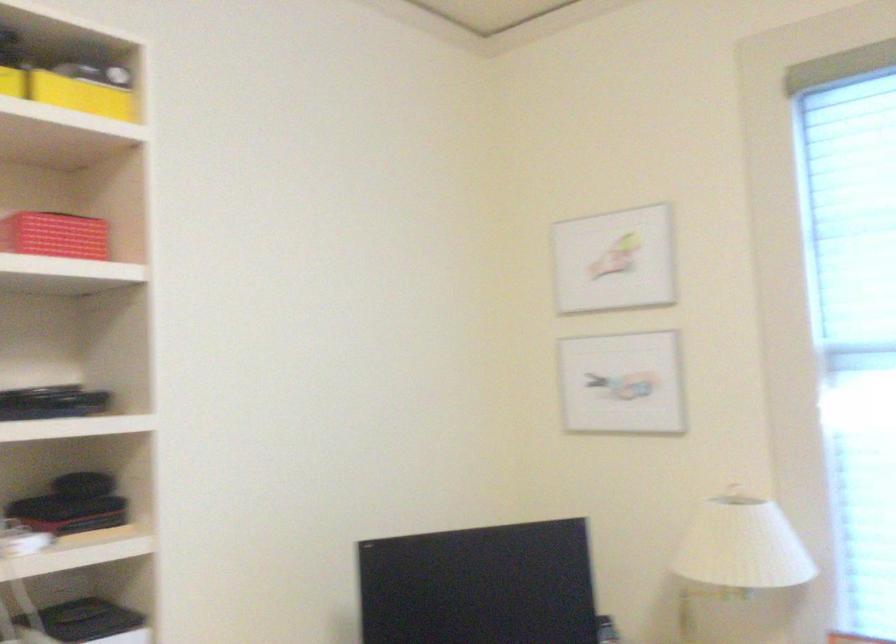
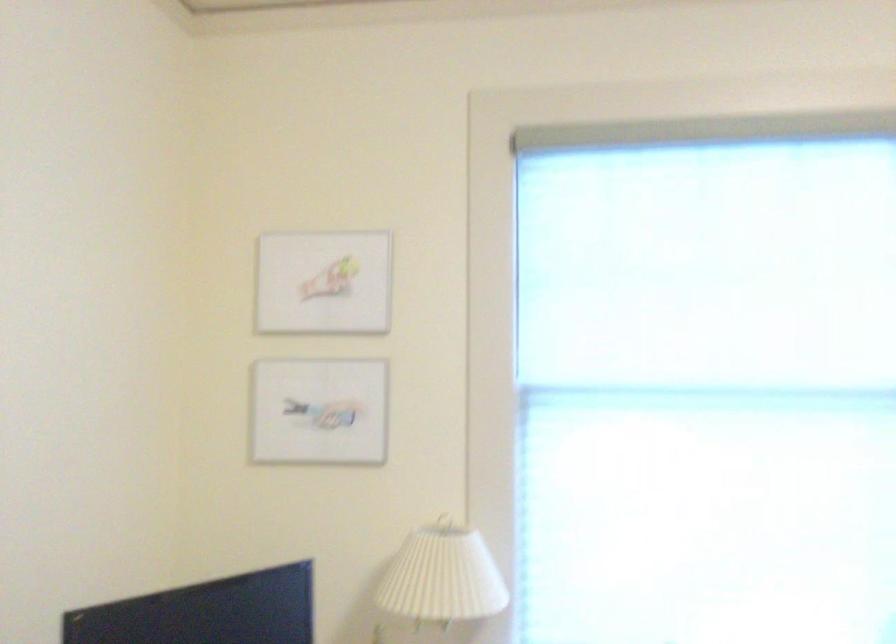
The point at (614, 258) is marked in the first image. Where is the corresponding point in the second image?

(323, 283)